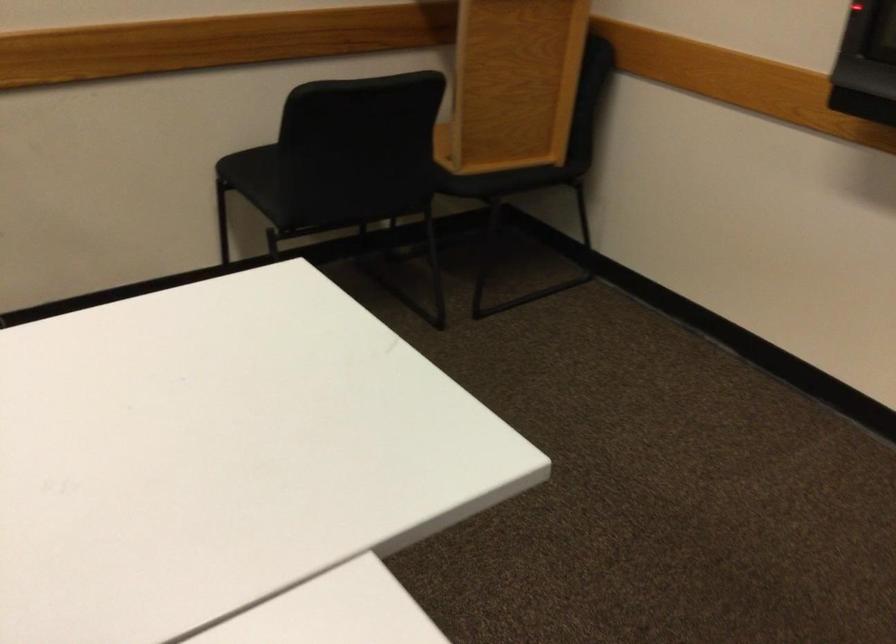
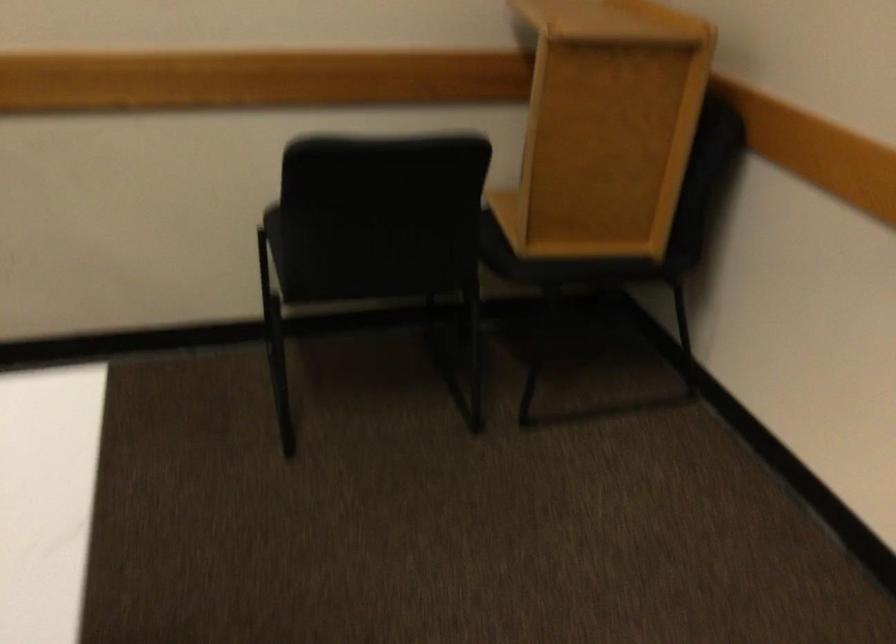
Question: The camera is either moving clockwise (left) or counter-clockwise (right) around the object. The first image is from the beginning of the video and the second image is from the end. Is the camera moving left or right when shooting the video?

Choices:
 (A) Left
 (B) Right

Answer: (B)